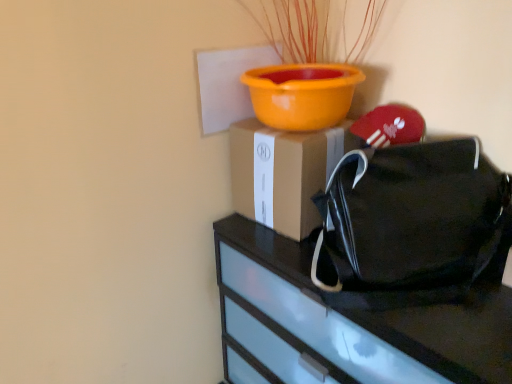
Question: Does brown cardboard box at center have a greater width compared to black fabric handbag at right?

Choices:
 (A) no
 (B) yes

Answer: (B)

Question: From a real-world perspective, is brown cardboard box at center positioned under black fabric handbag at right based on gravity?

Choices:
 (A) yes
 (B) no

Answer: (A)

Question: From the image's perspective, is brown cardboard box at center located beneath black fabric handbag at right?

Choices:
 (A) no
 (B) yes

Answer: (A)

Question: Is the position of brown cardboard box at center less distant than that of black fabric handbag at right?

Choices:
 (A) no
 (B) yes

Answer: (A)

Question: Can you confirm if brown cardboard box at center is bigger than black fabric handbag at right?

Choices:
 (A) no
 (B) yes

Answer: (A)

Question: From the image's perspective, is black fabric handbag at right positioned above or below black matte bag at right?

Choices:
 (A) above
 (B) below

Answer: (A)

Question: Is black fabric handbag at right inside the boundaries of black matte bag at right, or outside?

Choices:
 (A) inside
 (B) outside

Answer: (B)

Question: Visually, is black fabric handbag at right positioned to the left or to the right of black matte bag at right?

Choices:
 (A) right
 (B) left

Answer: (A)

Question: From a real-world perspective, is black fabric handbag at right positioned above or below black matte bag at right?

Choices:
 (A) above
 (B) below

Answer: (A)

Question: Which is correct: black matte bag at right is inside brown cardboard box at center, or outside of it?

Choices:
 (A) outside
 (B) inside

Answer: (A)

Question: Is black matte bag at right to the left or to the right of brown cardboard box at center in the image?

Choices:
 (A) right
 (B) left

Answer: (A)

Question: Is point (395, 327) closer or farther from the camera than point (312, 213)?

Choices:
 (A) farther
 (B) closer

Answer: (B)

Question: From the image's perspective, is black matte bag at right located above or below brown cardboard box at center?

Choices:
 (A) below
 (B) above

Answer: (A)

Question: Is black fabric handbag at right inside or outside of brown cardboard box at center?

Choices:
 (A) outside
 (B) inside

Answer: (A)

Question: Would you say black fabric handbag at right is to the left or to the right of brown cardboard box at center in the picture?

Choices:
 (A) left
 (B) right

Answer: (B)